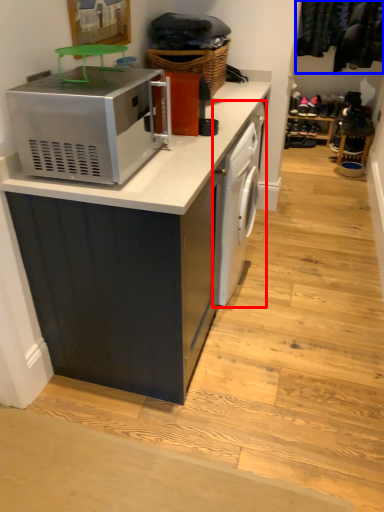
Question: Which object is closer to the camera taking this photo, dish washer (highlighted by a red box) or laundry (highlighted by a blue box)?

Choices:
 (A) dish washer
 (B) laundry

Answer: (A)